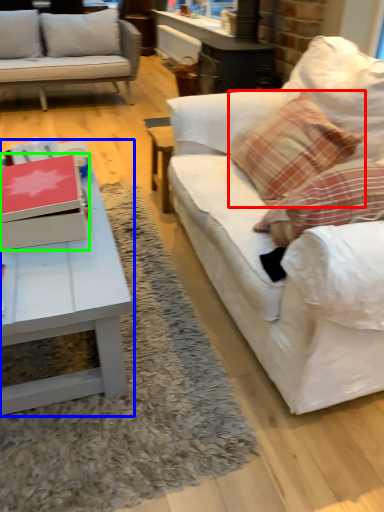
Question: Which is farther away from pillow (highlighted by a red box)? coffee table (highlighted by a blue box) or box (highlighted by a green box)?

Choices:
 (A) coffee table
 (B) box

Answer: (B)